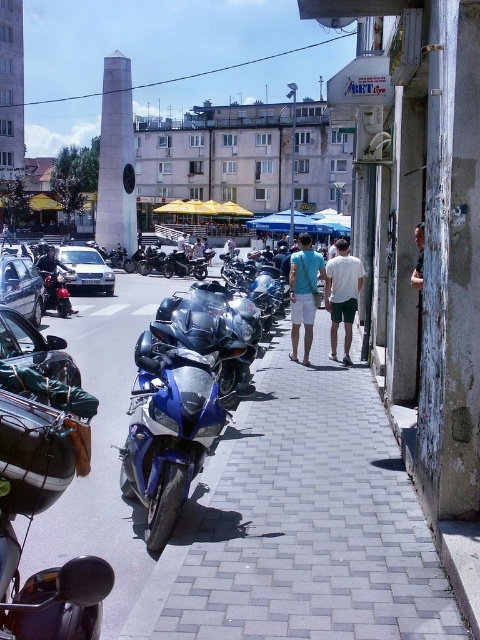
Is white cotton shirt at center taller than shiny chrome motorcycle at left?

Yes.

Is white cotton shirt at center to the right of shiny chrome motorcycle at left from the viewer's perspective?

Indeed, white cotton shirt at center is positioned on the right side of shiny chrome motorcycle at left.

Who is more distant from viewer, (334, 342) or (51, 260)?

Point (51, 260)

Locate an element on the screen. white cotton shirt at center is located at coordinates (343, 296).

Which of these two, white cotton shirt at center or shiny blue motorcycle at center, stands taller?

white cotton shirt at center

Is point (345, 241) more distant than point (206, 262)?

No, (345, 241) is closer to viewer.

Locate an element on the screen. The width and height of the screenshot is (480, 640). white cotton shirt at center is located at coordinates (343, 296).

Is glossy metallic motorcycle at center above shiny chrome motorcycle at left?

No, glossy metallic motorcycle at center is not above shiny chrome motorcycle at left.

Does glossy metallic motorcycle at center have a lesser width compared to shiny chrome motorcycle at left?

No, glossy metallic motorcycle at center is not thinner than shiny chrome motorcycle at left.

Describe the element at coordinates (168, 429) in the screenshot. This screenshot has width=480, height=640. I see `glossy metallic motorcycle at center` at that location.

Locate an element on the screen. The image size is (480, 640). glossy metallic motorcycle at center is located at coordinates (168, 429).